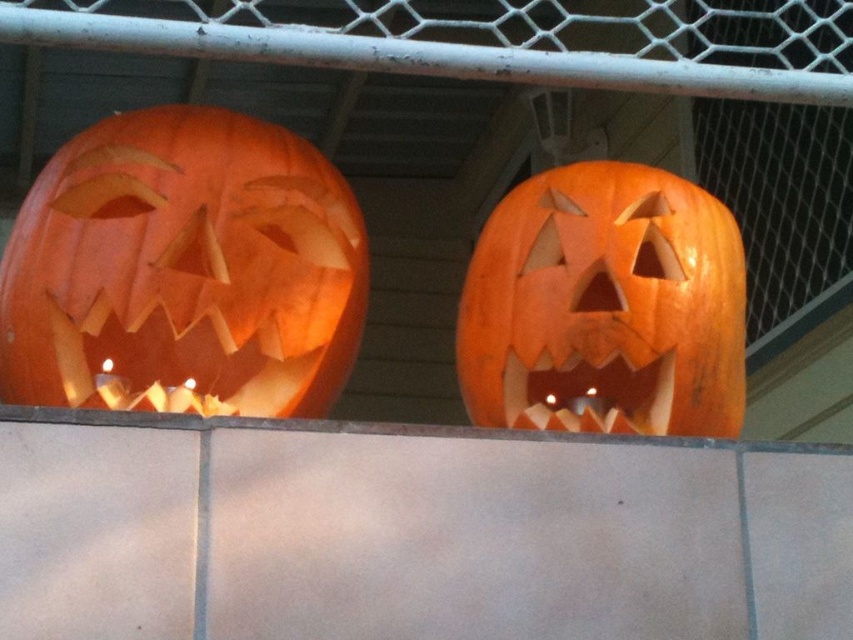
You are standing in front of two Halloween pumpkins. There are two points marked in the scene, one at coordinates point (49, 202) and the other at point (547, 326). Which point is closer to you?

Point (49, 202) is closer to the viewer than point (547, 326).

You are standing in front of the two carved pumpkins. The orange carved pumpkin at left is 8.68 meters from camera. Can you determine which pumpkin is closer to you?

The orange carved pumpkin at left is 8.68 meters from camera, so the other pumpkin is closer to you.